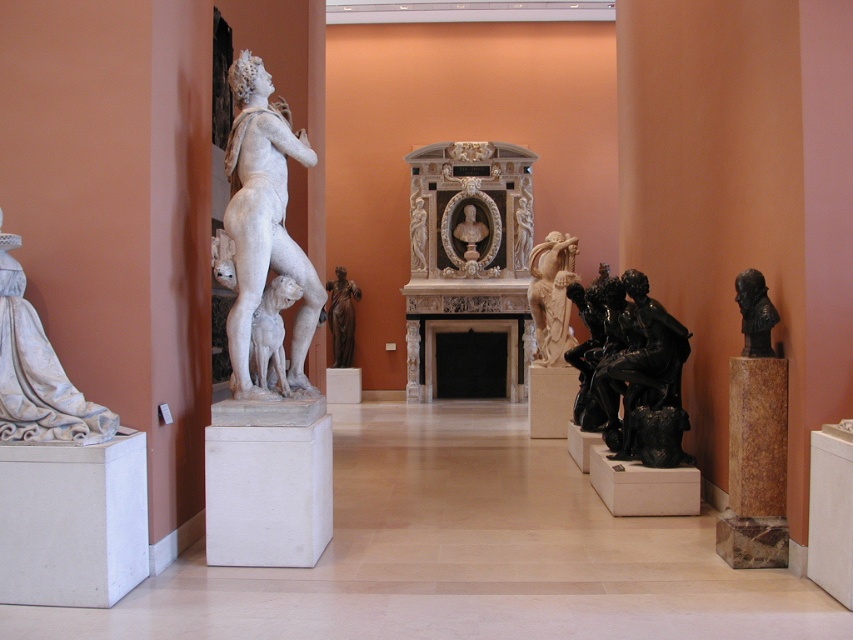
Question: Does black polished marble group at center appear on the left side of light beige marble statue at center?

Choices:
 (A) no
 (B) yes

Answer: (A)

Question: Is white marble statue at left bigger than white marble statue at center?

Choices:
 (A) yes
 (B) no

Answer: (A)

Question: Which object is closer to the camera taking this photo?

Choices:
 (A) white marble statue at center
 (B) black polished marble group at center

Answer: (A)

Question: Which point is closer to the camera?

Choices:
 (A) (753, 316)
 (B) (236, 344)
 (C) (62, 404)
 (D) (335, 337)

Answer: (C)

Question: Which point appears closest to the camera in this image?

Choices:
 (A) (292, 360)
 (B) (558, 344)
 (C) (276, 356)
 (D) (668, 396)

Answer: (C)

Question: Considering the relative positions of black polished marble group at center and white marble statue at center in the image provided, where is black polished marble group at center located with respect to white marble statue at center?

Choices:
 (A) below
 (B) above

Answer: (A)